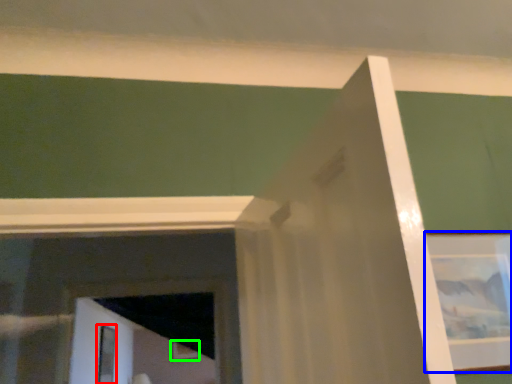
Question: Based on their relative distances, which object is nearer to screen door (highlighted by a red box)? Choose from picture frame (highlighted by a blue box) and picture frame (highlighted by a green box).

Choices:
 (A) picture frame
 (B) picture frame

Answer: (B)